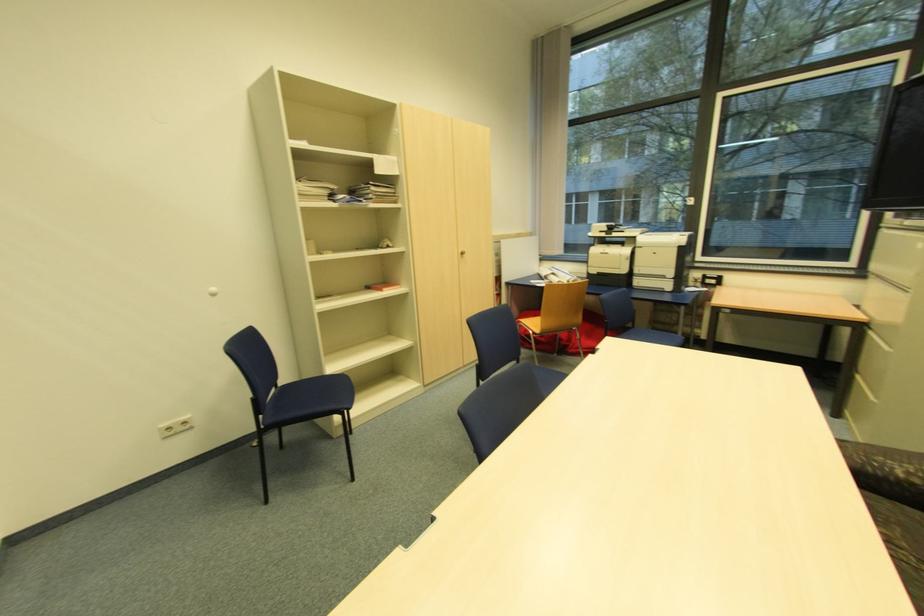
Find where to pull the recessed drawer handle. Please return your answer as a coordinate pair (x, y).

(864, 387)